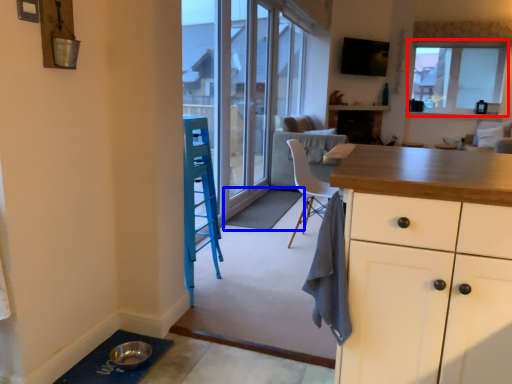
Question: Which object appears closest to the camera in this image, window (highlighted by a red box) or doormat (highlighted by a blue box)?

Choices:
 (A) window
 (B) doormat

Answer: (B)